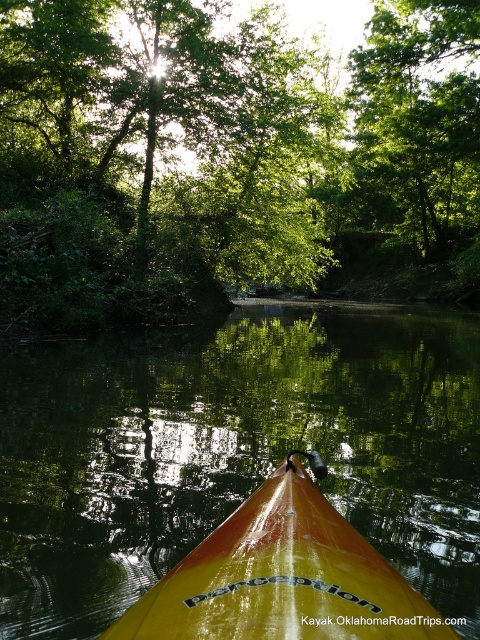
You are in a kayak on a calm river and want to reach a point that is further away from you. Which point should you paddle towards, point at coordinates (243, 28) or point at coordinates (363, 582)?

You should paddle towards point at coordinates (363, 582) because it is further away from you compared to point at coordinates (243, 28).

You are kayaking on a calm river and notice two green leafy trees ahead. The first is labeled as green leafy trees at center and the second as green leafy tree at upper center. If your kayak is 2 meters wide, can you safely pass between them without touching either tree?

The distance between the green leafy trees at center and the green leafy tree at upper center is 6.12 meters. Since your kayak is only 2 meters wide, there is sufficient space to pass safely between them as the gap is wider than the kayak.

You are a drone operator trying to capture a photo of the yellow glossy kayak at lower center from above. The drone is currently hovering at the center of the scene. What direction should you move the drone to align it with the kayak?

The yellow glossy kayak at lower center is located at point 0.705 on the x axis and 0.487 on the y axis. Since the drone is at the center, which is point 0.5 on both axes, you should move the drone to the right and slightly downward to align with the kayak.